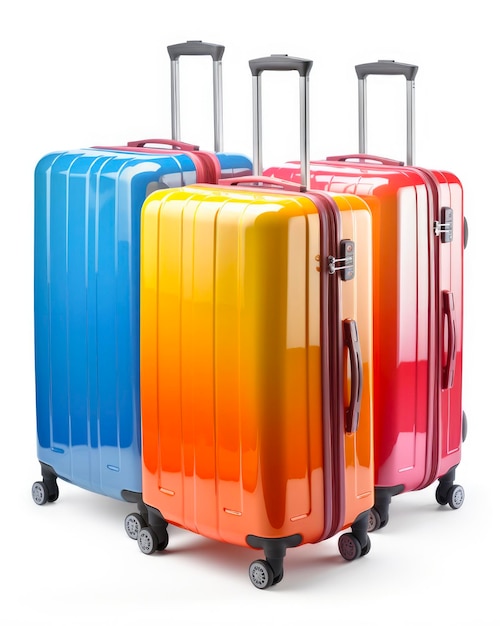
Identify the location of caster. (266, 578), (348, 548), (457, 496), (377, 518), (153, 539), (129, 516), (38, 494).